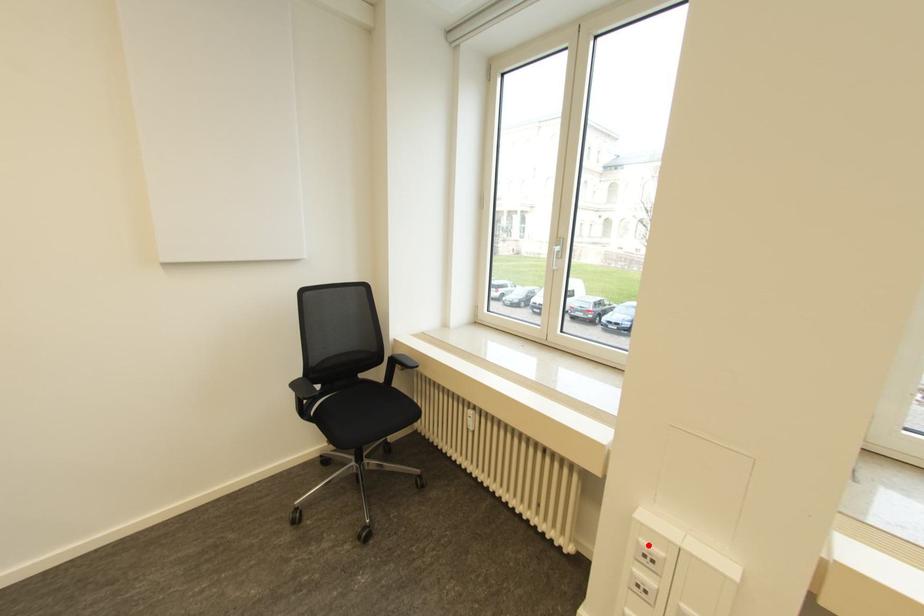
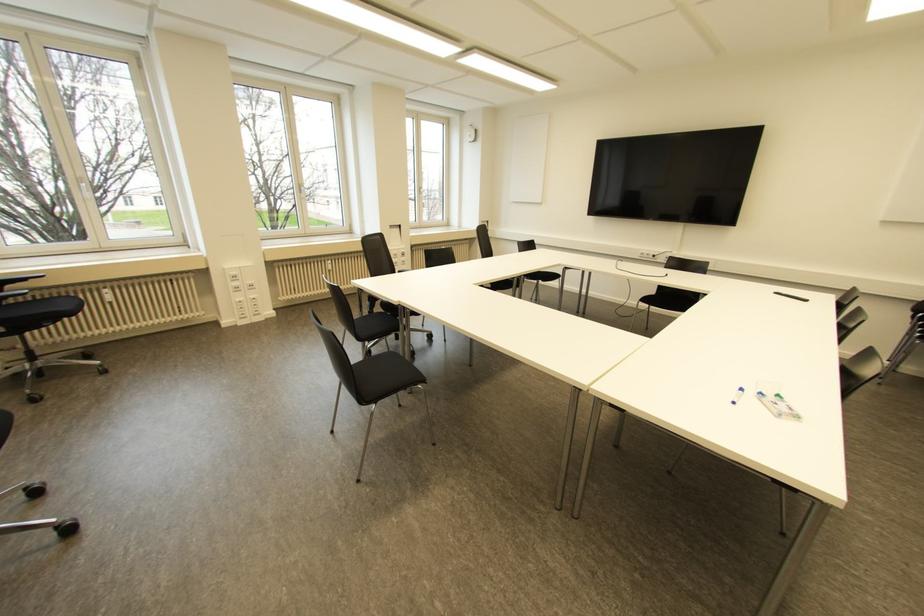
Question: I am providing you with two images of the same scene from different viewpoints. Given a red point in image1, look at the same physical point in image2. Is it:

Choices:
 (A) Closer to the viewpoint
 (B) Farther from the viewpoint

Answer: (A)